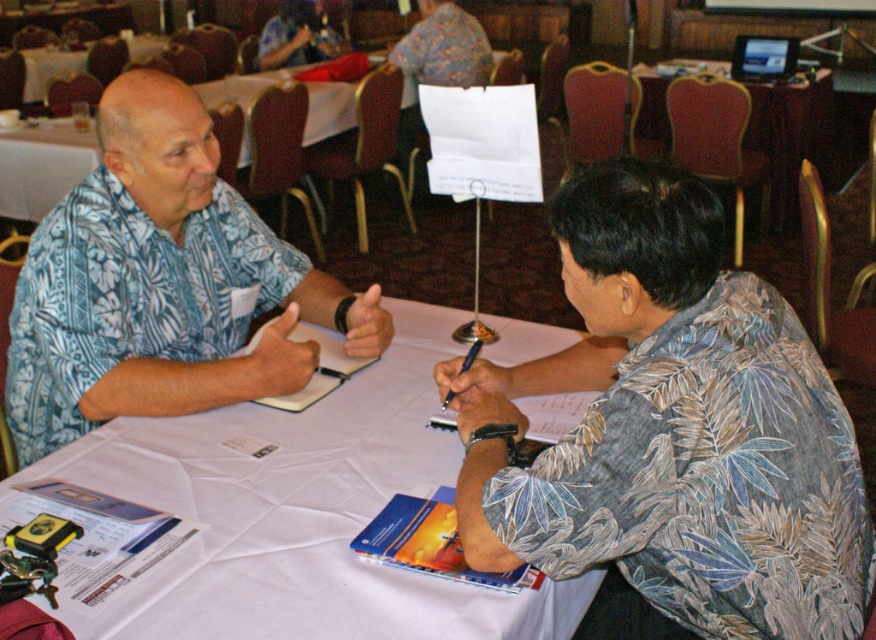
Question: Which of these objects is positioned farthest from the printed fabric shirt at center?

Choices:
 (A) white paper table at center
 (B) matte blue shirt at upper left
 (C) blue floral shirt at left
 (D) wooden table at upper right

Answer: (B)

Question: Does printed fabric shirt at center have a smaller size compared to blue floral shirt at left?

Choices:
 (A) yes
 (B) no

Answer: (B)

Question: Which is nearer to the wooden table at upper right?

Choices:
 (A) blue floral shirt at left
 (B) white paper table at center
 (C) matte blue shirt at upper left

Answer: (C)

Question: Can you confirm if printed fabric shirt at center is thinner than matte blue shirt at upper left?

Choices:
 (A) yes
 (B) no

Answer: (B)

Question: Is white paper table at center to the right of blue floral shirt at left from the viewer's perspective?

Choices:
 (A) yes
 (B) no

Answer: (A)

Question: Which object appears closest to the camera in this image?

Choices:
 (A) white paper table at center
 (B) printed fabric shirt at center

Answer: (B)